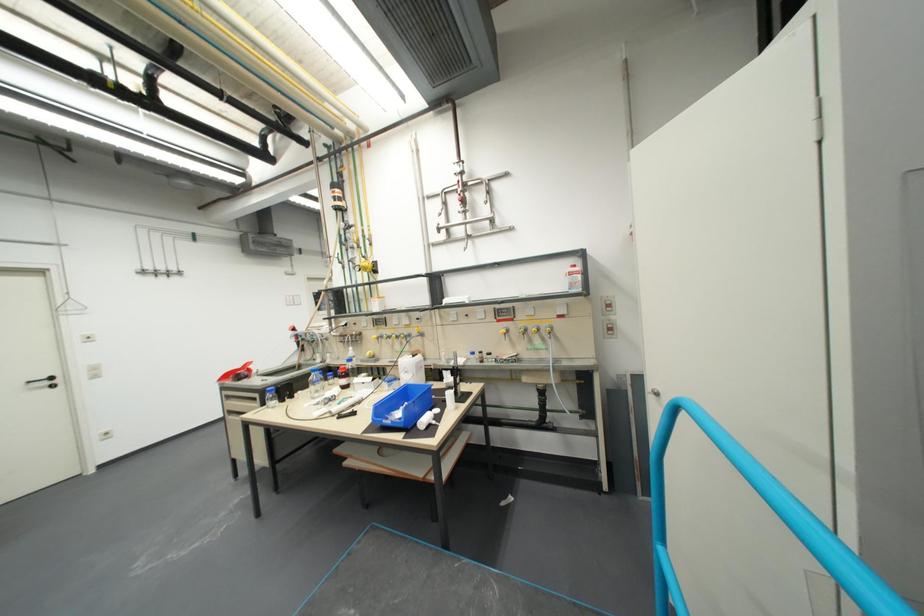
Describe the element at coordinates (609, 315) in the screenshot. I see `the red wall switch` at that location.